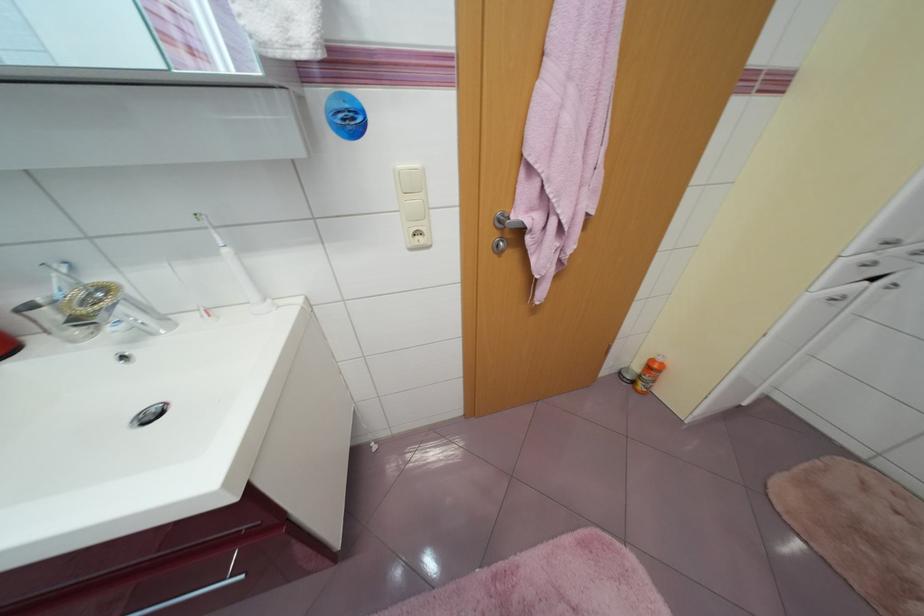
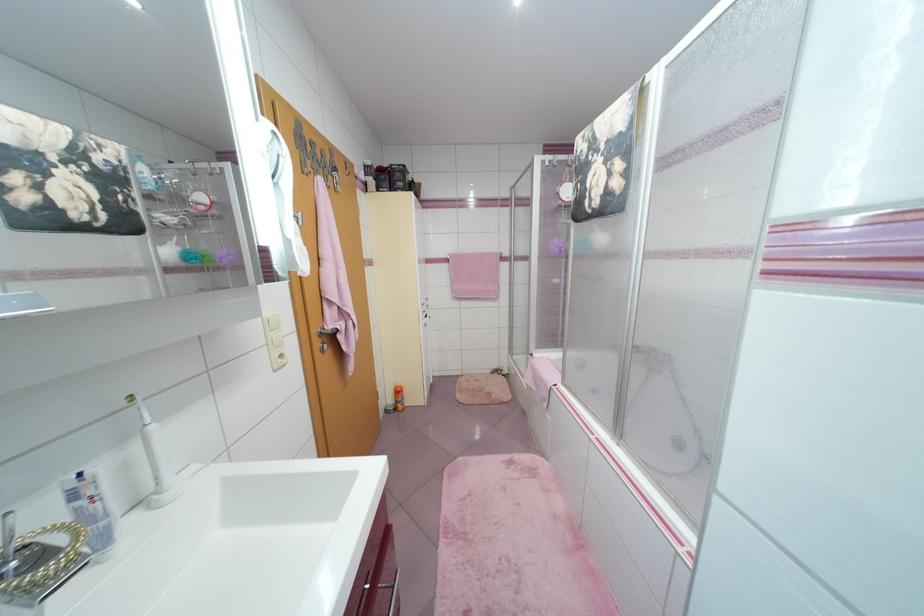
Question: The camera is either moving clockwise (left) or counter-clockwise (right) around the object. The first image is from the beginning of the video and the second image is from the end. Is the camera moving left or right when shooting the video?

Choices:
 (A) Left
 (B) Right

Answer: (A)